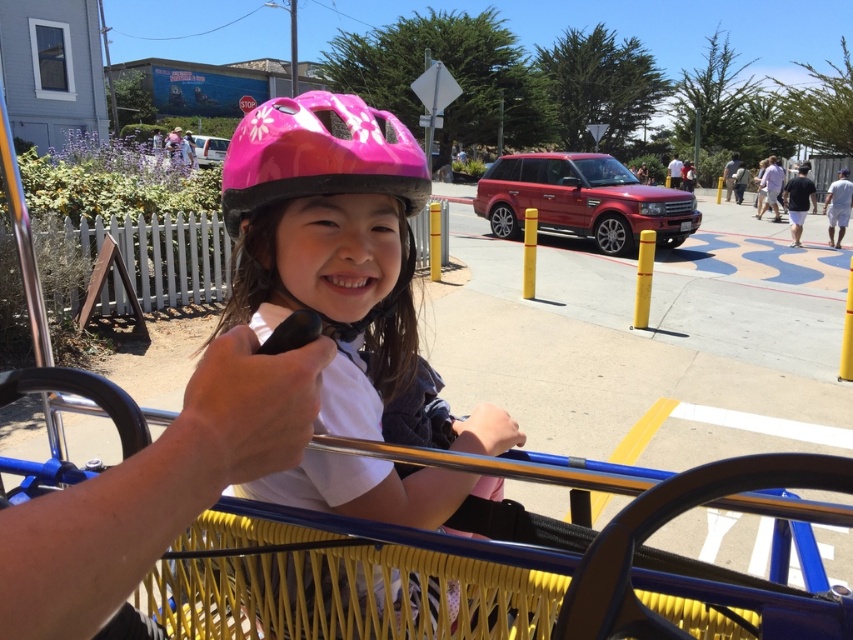
Where is `pink matte helmet at center`? The width and height of the screenshot is (853, 640). pink matte helmet at center is located at coordinates (329, 243).

Does point (350, 474) lie behind point (846, 628)?

Yes, it is behind point (846, 628).

Who is more distant from viewer, (x=363, y=465) or (x=732, y=596)?

Positioned behind is point (x=363, y=465).

Find the location of a particular element. pink matte helmet at center is located at coordinates point(329,243).

Can you confirm if pink matte helmet at center is shorter than pink glossy bicycle helmet at center?

In fact, pink matte helmet at center may be taller than pink glossy bicycle helmet at center.

Which is in front, point (393, 145) or point (300, 99)?

Point (393, 145)

Is point (379, 154) in front of point (409, 150)?

Yes, point (379, 154) is in front of point (409, 150).

Locate an element on the screen. The height and width of the screenshot is (640, 853). pink matte helmet at center is located at coordinates (329, 243).

Who is taller, yellow woven basket at center or pink glossy bicycle helmet at center?

With more height is yellow woven basket at center.

Between point (737, 595) and point (320, 170), which one is positioned in front?

Positioned in front is point (737, 595).

Locate an element on the screen. yellow woven basket at center is located at coordinates click(x=735, y=592).